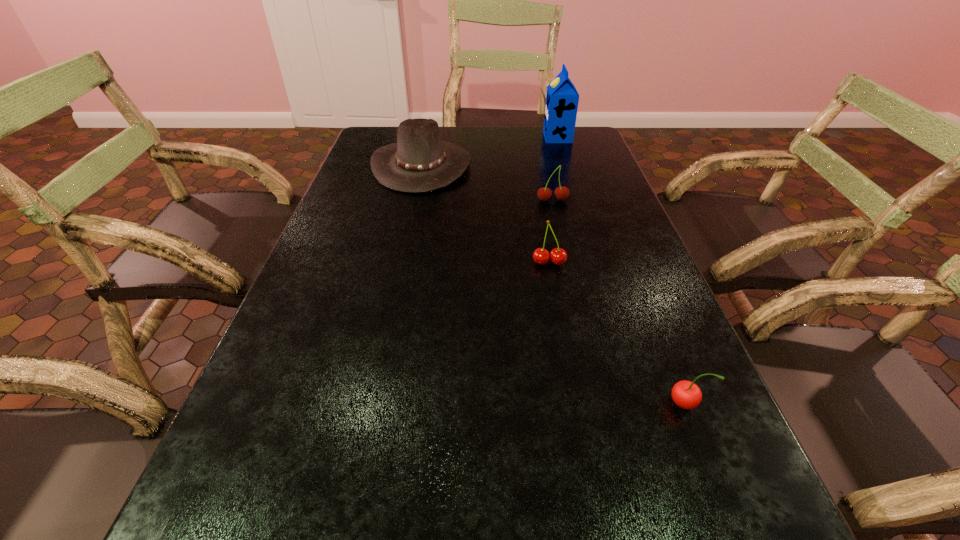
The image size is (960, 540). What are the coordinates of `free space at the left edge of the desktop` in the screenshot? It's located at (255, 433).

Where is `vacant space at the right edge of the desktop`? The width and height of the screenshot is (960, 540). vacant space at the right edge of the desktop is located at coordinates (614, 310).

Image resolution: width=960 pixels, height=540 pixels. Find the location of `blank region between the third farthest object and the tallest object`. blank region between the third farthest object and the tallest object is located at coordinates [x=555, y=169].

The height and width of the screenshot is (540, 960). In order to click on free space between the leftmost object and the fourth farthest object in this screenshot , I will do `click(486, 214)`.

The image size is (960, 540). I want to click on unoccupied position between the leftmost object and the farthest cherry, so click(487, 183).

Locate an element on the screen. The height and width of the screenshot is (540, 960). free area in between the third farthest object and the nearest object is located at coordinates (618, 302).

The height and width of the screenshot is (540, 960). In order to click on vacant space in between the farthest cherry and the second nearest object in this screenshot , I will do `click(551, 232)`.

The width and height of the screenshot is (960, 540). In order to click on free space between the second nearest cherry and the carton in this screenshot , I will do `click(553, 200)`.

Identify the location of vacant space in between the second farthest cherry and the hat. The image size is (960, 540). (486, 214).

Find the location of a particular element. vacant space in between the tallest object and the hat is located at coordinates [x=490, y=151].